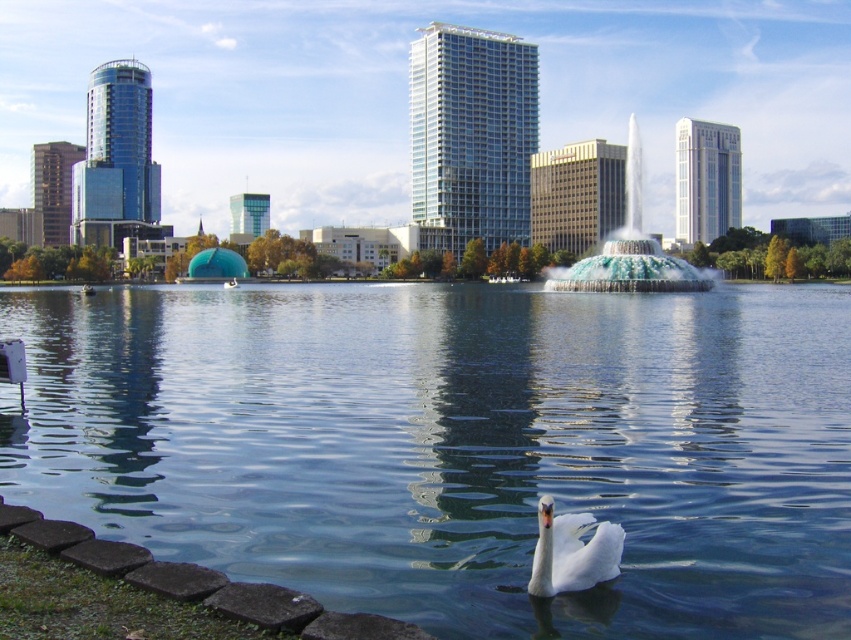
You are a tour guide leading a group to the blue glass fountain at center. A tourist asks if they can walk directly from the white glossy swan at lower center to the fountain without crossing any obstacles. Based on the scene description, what do you tell them?

The distance between the blue glass fountain at center and the white glossy swan at lower center is 56.94 meters. Since the scene describes a serene waterfront with calm water and no mentioned obstacles between them, the tourist can walk directly from the white glossy swan at lower center to the blue glass fountain at center without crossing any obstacles.

You are a photographer planning to capture the clear water at center and the white glossy swan at lower center in a single frame. Given that your camera has a fixed focal length, which object should you prioritize positioning closer to avoid cropping either subject?

The clear water at center should be prioritized closer since its width surpasses that of the white glossy swan at lower center, making it larger and requiring more space in the frame.

You are standing at the waterfront and want to reach a specific point marked as point (586, 289). If your walking speed is 1.5 meters per second, how many seconds will it take you to reach that point?

The distance to point (586, 289) is 53.18 meters. At a speed of 1.5 meters per second, it would take approximately 35.45 seconds to reach the point.